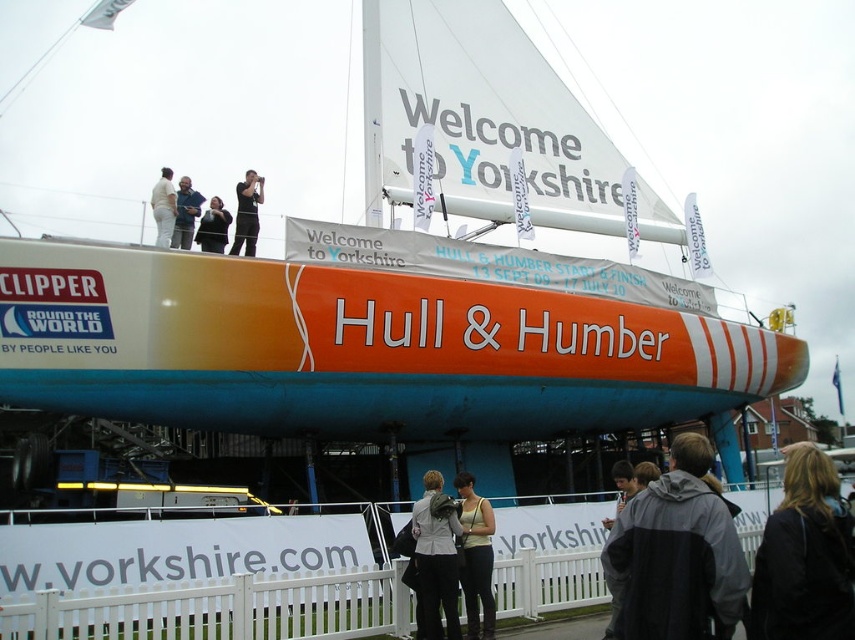
Question: Which object appears closest to the camera in this image?

Choices:
 (A) dark gray jacket at upper center
 (B) black fabric at upper center
 (C) light gray fabric jacket at lower center
 (D) white fabric at upper center

Answer: (C)

Question: In this image, where is white fabric at upper center located relative to matte black jacket at upper center?

Choices:
 (A) left
 (B) right

Answer: (A)

Question: Which point is closer to the camera?

Choices:
 (A) (237, 192)
 (B) (447, 570)

Answer: (B)

Question: Among these objects, which one is farthest from the camera?

Choices:
 (A) gray fabric jacket at lower right
 (B) light green tank top at center
 (C) black fabric jacket at lower right

Answer: (B)

Question: Can you confirm if black fabric at upper center is positioned above dark gray jacket at upper center?

Choices:
 (A) no
 (B) yes

Answer: (B)

Question: Is light green tank top at center bigger than matte black jacket at upper center?

Choices:
 (A) no
 (B) yes

Answer: (B)